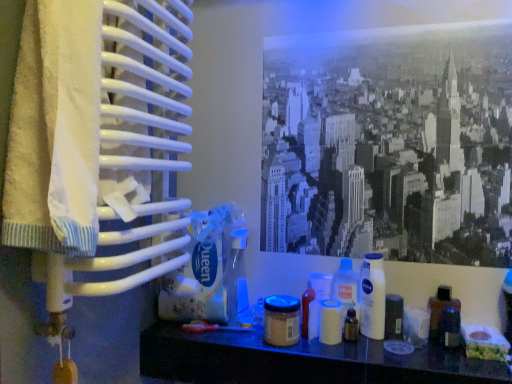
Locate an element on the screen. vacant area located to the right-hand side of translucent plastic bottle at lower center, the 2th toiletry viewed from the right is located at coordinates (417, 350).